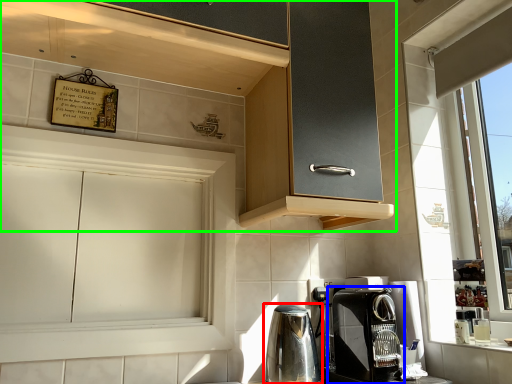
Question: Considering the real-world distances, which object is closest to home appliance (highlighted by a red box)? coffee maker (highlighted by a blue box) or cabinetry (highlighted by a green box).

Choices:
 (A) coffee maker
 (B) cabinetry

Answer: (A)